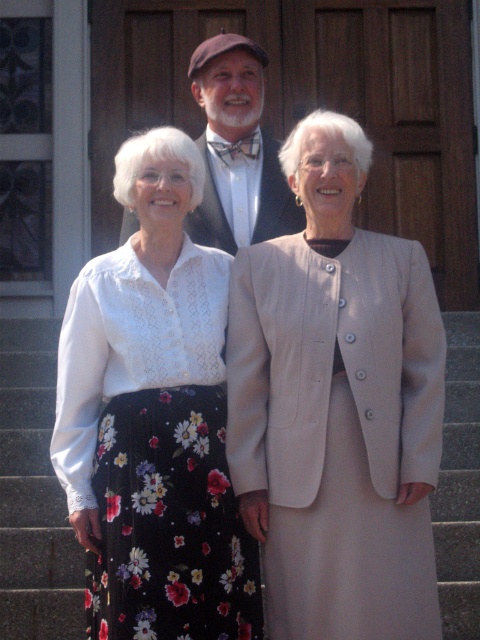
Can you confirm if black floral skirt at lower left is taller than matte black bow tie at center?

Incorrect, black floral skirt at lower left's height is not larger of matte black bow tie at center's.

Is point (34, 536) positioned before point (286, 184)?

Yes, point (34, 536) is in front of point (286, 184).

Describe the element at coordinates (34, 493) in the screenshot. I see `black floral skirt at lower left` at that location.

Where is `black floral skirt at lower left`? black floral skirt at lower left is located at coordinates (34, 493).

Is beige fabric skirt at center behind matte black bow tie at center?

No, beige fabric skirt at center is in front of matte black bow tie at center.

Which of these two, beige fabric skirt at center or matte black bow tie at center, stands shorter?

With less height is matte black bow tie at center.

Describe the element at coordinates (336, 406) in the screenshot. Image resolution: width=480 pixels, height=640 pixels. I see `beige fabric skirt at center` at that location.

At what (x,y) coordinates should I click in order to perform the action: click on beige fabric skirt at center. Please return your answer as a coordinate pair (x, y). Looking at the image, I should click on (336, 406).

Is beige fabric skirt at center shorter than floral-patterned skirt at center?

Incorrect, beige fabric skirt at center's height does not fall short of floral-patterned skirt at center's.

Between beige fabric skirt at center and floral-patterned skirt at center, which one is positioned lower?

floral-patterned skirt at center

At what (x,y) coordinates should I click in order to perform the action: click on beige fabric skirt at center. Please return your answer as a coordinate pair (x, y). The image size is (480, 640). Looking at the image, I should click on (336, 406).

Locate an element on the screen. This screenshot has width=480, height=640. beige fabric skirt at center is located at coordinates 336,406.